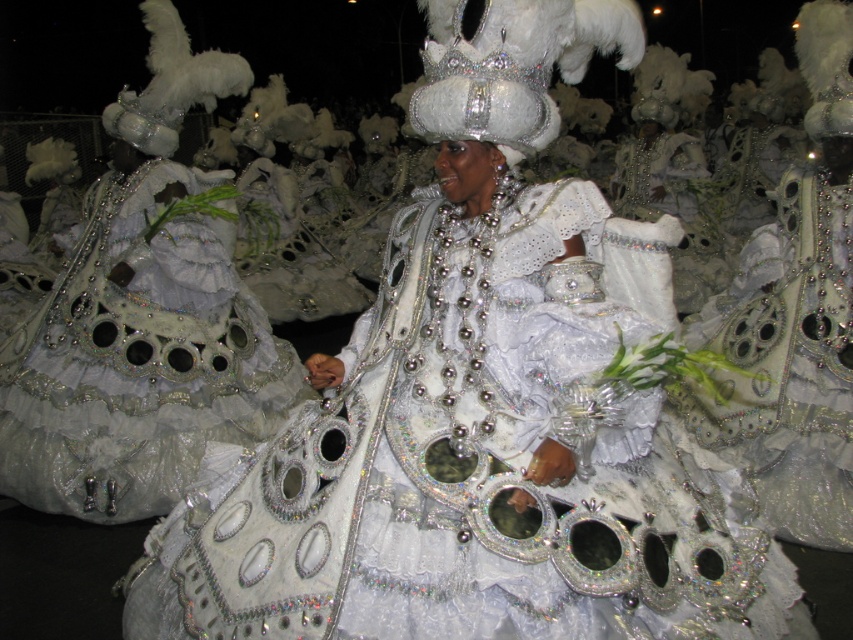
You are a photographer at the event and want to capture both the glittery white dress at center and the shiny silver gown at center in a single photo. What is the minimum distance you need to move back to ensure both are fully visible in your frame?

The glittery white dress at center and the shiny silver gown at center are 1.33 meters apart. To capture both in a single photo, you need to move back at least 1.33 meters to ensure the entire distance between them fits within your frame.

You are a photographer at the carnival. You want to take a photo of the sparkly silver dress at center and the white sequined crown at center. Which object should you focus on first if you want to capture both in the same frame without moving the camera?

The sparkly silver dress at center is below the white sequined crown at center, so you should focus on the white sequined crown at center first to ensure both are in the frame without moving the camera.

You are a photographer at the event and want to capture a photo of the shiny silver gown at center and the white sequined crown at center in the same frame. Given that your camera has a minimum focus distance of 1.5 meters, will you be able to take the photo without moving closer?

The shiny silver gown at center and the white sequined crown at center are 1.69 meters apart. Since the distance between them is greater than the camera minimum focus distance of 1.5 meters, the photographer can capture both in the same frame without moving closer.